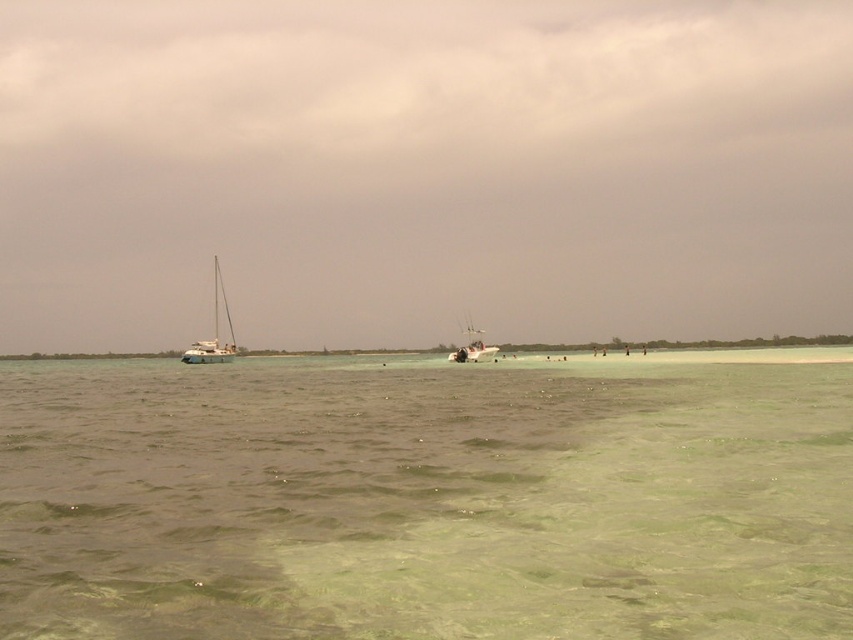
You are a marine biologist planning to anchor a research buoy at coordinates point 0.517, 0.251. Is the white matte sailboat at left currently positioned where you want to place the buoy?

The white matte sailboat at left is located at point (213, 330), so yes, the boat is currently at the coordinates where you want to place the buoy.

You are a photographer planning to take a photo of the white matte sailboat at left in the coastal scene. The sailboat is represented by the point at coordinates (x=213, y=330). Based on the scene description, where should you position the sailboat in your camera frame to ensure it is centered?

The white matte sailboat at left is represented by point (x=213, y=330), so you should position it at the center of your camera frame by aligning the point at coordinates (x=213, y=330) to the center of the viewfinder.

You are a photographer planning to capture the white matte sailboat at left and the green translucent water at center in a single shot. Based on their positions, do you think the sailboat will appear smaller in the photo compared to the water?

The white matte sailboat at left is positioned further away from the photographer than the green translucent water at center. Since objects farther away appear smaller, the sailboat will likely appear smaller in the photo compared to the water.